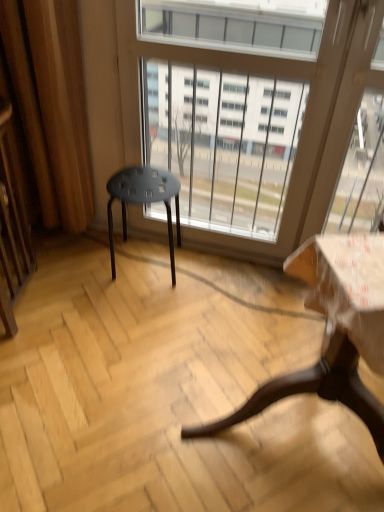
Question: Can you confirm if wooden screen door at left is taller than matte black stool at center?

Choices:
 (A) yes
 (B) no

Answer: (A)

Question: Considering the relative sizes of wooden screen door at left and matte black stool at center in the image provided, is wooden screen door at left bigger than matte black stool at center?

Choices:
 (A) no
 (B) yes

Answer: (B)

Question: Is wooden screen door at left at the right side of matte black stool at center?

Choices:
 (A) no
 (B) yes

Answer: (A)

Question: Can we say wooden screen door at left lies outside matte black stool at center?

Choices:
 (A) yes
 (B) no

Answer: (A)

Question: Is wooden screen door at left thinner than matte black stool at center?

Choices:
 (A) yes
 (B) no

Answer: (B)

Question: Considering the relative sizes of wooden screen door at left and matte black stool at center in the image provided, is wooden screen door at left wider than matte black stool at center?

Choices:
 (A) yes
 (B) no

Answer: (A)

Question: Is transparent glass window at center positioned before wooden table at lower right?

Choices:
 (A) no
 (B) yes

Answer: (A)

Question: Does transparent glass window at center lie behind wooden table at lower right?

Choices:
 (A) yes
 (B) no

Answer: (A)

Question: Does transparent glass window at center have a lesser height compared to wooden table at lower right?

Choices:
 (A) no
 (B) yes

Answer: (A)

Question: From a real-world perspective, is transparent glass window at center located higher than wooden table at lower right?

Choices:
 (A) yes
 (B) no

Answer: (A)

Question: Is transparent glass window at center in contact with wooden table at lower right?

Choices:
 (A) yes
 (B) no

Answer: (B)

Question: Is transparent glass window at center not inside wooden table at lower right?

Choices:
 (A) no
 (B) yes

Answer: (B)

Question: Is wooden table at lower right at the left side of matte black stool at center?

Choices:
 (A) yes
 (B) no

Answer: (B)